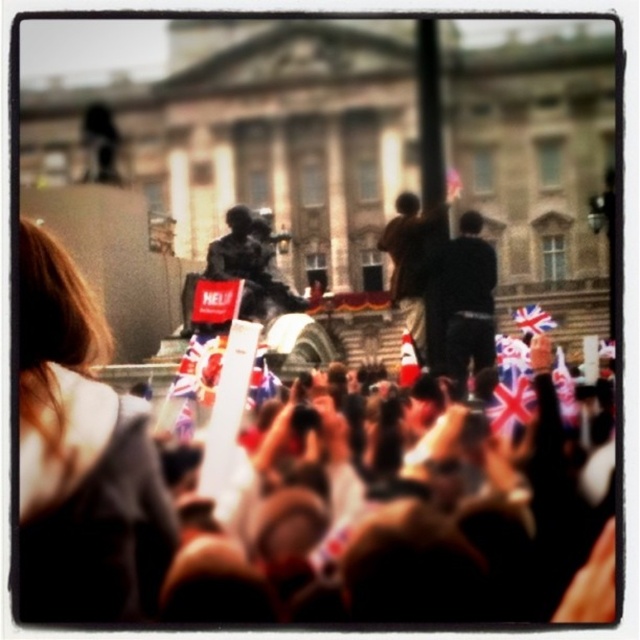
In the lively outdoor scene, you see a brown fabric at left and a dark brown leather jacket at center. Which object is positioned more to the left side of the image?

The brown fabric at left is positioned more to the left side of the image than the dark brown leather jacket at center.

You are standing in the crowd and want to take a photo of the statue. The statue has two brown fabrics attached to it. Which brown fabric, the brown textured fabric at center or the brown fabric at left, is positioned lower on the statue?

The brown textured fabric at center is positioned lower than the brown fabric at left on the statue.